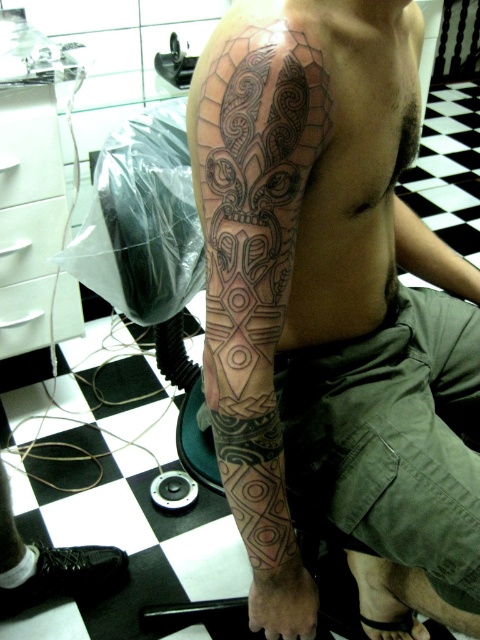
Question: Observing the image, what is the correct spatial positioning of black ink tattoo at upper arm in reference to black ink tattoo at lower right?

Choices:
 (A) below
 (B) above

Answer: (A)

Question: Is black ink tattoo at upper arm above black ink tattoo at lower right?

Choices:
 (A) yes
 (B) no

Answer: (B)

Question: Considering the real-world distances, which object is closest to the black ink tattoo at lower right?

Choices:
 (A) black ink tattoo at upper arm
 (B) black ink tattoo at upper center

Answer: (A)

Question: Can you confirm if black ink tattoo at upper center is positioned above black ink tattoo at lower right?

Choices:
 (A) yes
 (B) no

Answer: (B)

Question: Which object is farther from the camera taking this photo?

Choices:
 (A) black ink tattoo at upper center
 (B) black ink tattoo at lower right
 (C) black ink tattoo at upper arm

Answer: (B)

Question: Based on their relative distances, which object is nearer to the black ink tattoo at lower right?

Choices:
 (A) black ink tattoo at upper arm
 (B) black ink tattoo at upper center

Answer: (A)